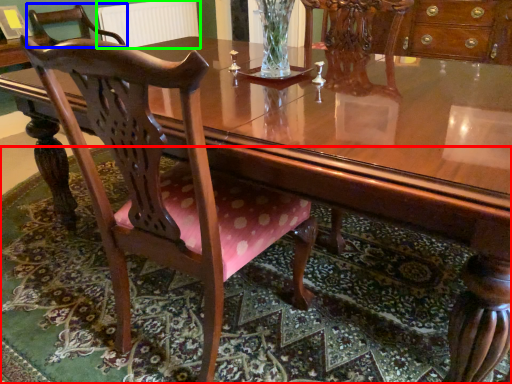
Question: Based on their relative distances, which object is nearer to mat (highlighted by a red box)? Choose from chair (highlighted by a blue box) and radiator (highlighted by a green box).

Choices:
 (A) chair
 (B) radiator

Answer: (B)